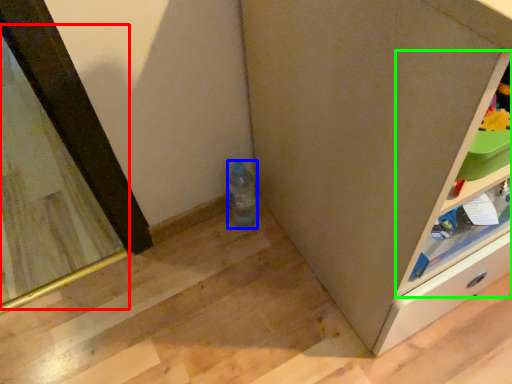
Question: Based on their relative distances, which object is nearer to mirror (highlighted by a red box)? Choose from bottle (highlighted by a blue box) and shelf (highlighted by a green box).

Choices:
 (A) bottle
 (B) shelf

Answer: (A)